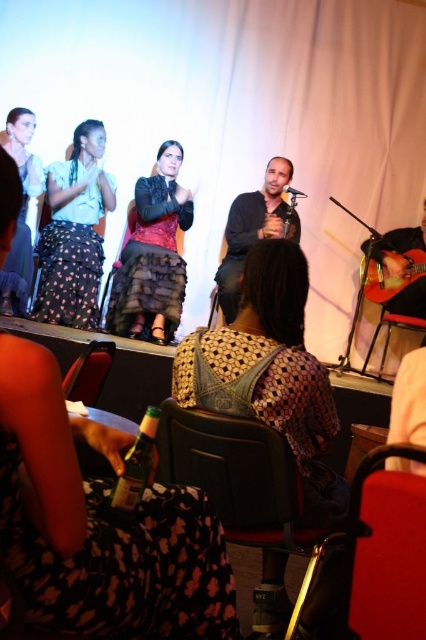
Question: Can you confirm if matte black skirt at left is positioned to the right of acoustic guitar at right?

Choices:
 (A) yes
 (B) no

Answer: (B)

Question: Which object is positioned farthest from the dark gray sweater at center?

Choices:
 (A) acoustic guitar at right
 (B) velvet black dress at center

Answer: (A)

Question: Which point is farther from the camera taking this photo?

Choices:
 (A) (71, 380)
 (B) (127, 548)

Answer: (A)

Question: Considering the relative positions of matte black dress at left and leather seat at lower left in the image provided, where is matte black dress at left located with respect to leather seat at lower left?

Choices:
 (A) right
 (B) left

Answer: (B)

Question: Which object appears closest to the camera in this image?

Choices:
 (A) leather seat at lower left
 (B) green glass bottle at lower left
 (C) metallic silver microphone at center
 (D) dark gray sweater at center

Answer: (B)

Question: Is velvet black dress at center to the right of metallic silver microphone at center from the viewer's perspective?

Choices:
 (A) yes
 (B) no

Answer: (B)